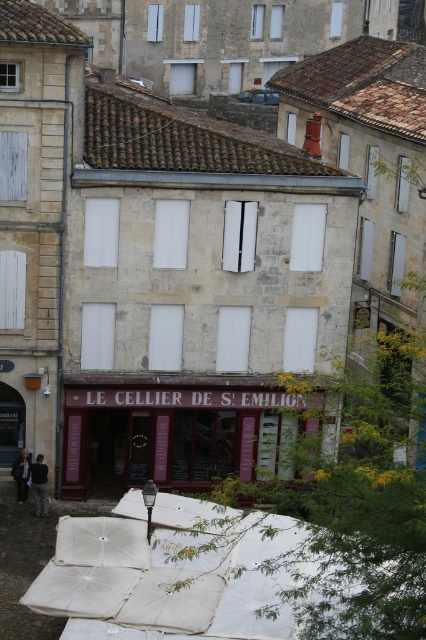
Question: Which of the following is the closest to the observer?

Choices:
 (A) beige fabric umbrella at lower center
 (B) dark gray jacket at lower left

Answer: (A)

Question: Is beige fabric umbrella at lower center below dark gray jacket at lower left?

Choices:
 (A) yes
 (B) no

Answer: (A)

Question: Does beige fabric umbrella at lower center appear on the left side of dark gray jacket at lower left?

Choices:
 (A) no
 (B) yes

Answer: (A)

Question: Which of the following is the farthest from the observer?

Choices:
 (A) beige fabric umbrella at lower center
 (B) black leather jacket at lower left
 (C) dark gray jacket at lower left

Answer: (C)

Question: Is beige fabric umbrella at lower center in front of dark gray jacket at lower left?

Choices:
 (A) yes
 (B) no

Answer: (A)

Question: Which of the following is the closest to the observer?

Choices:
 (A) dark gray jacket at lower left
 (B) black leather jacket at lower left
 (C) beige fabric umbrella at lower center

Answer: (C)